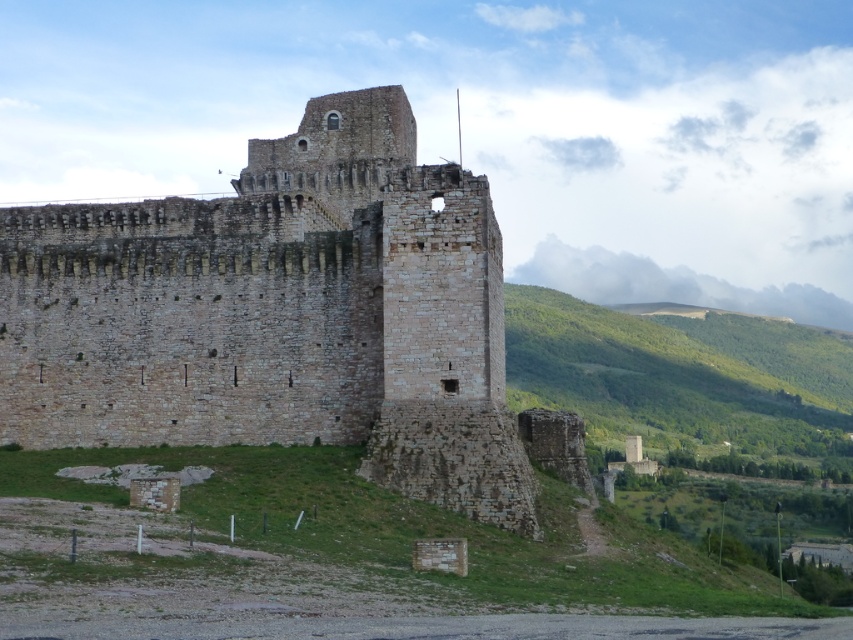
Is brown stone castle at center in front of green leafy hillside at right?

That is True.

Can you confirm if brown stone castle at center is thinner than green leafy hillside at right?

Indeed, brown stone castle at center has a lesser width compared to green leafy hillside at right.

The image size is (853, 640). In order to click on brown stone castle at center in this screenshot , I will do click(x=279, y=314).